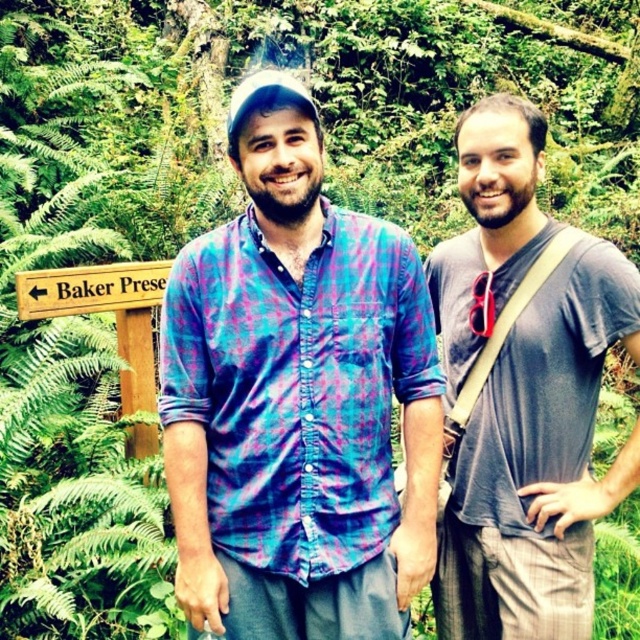
You are standing in a forest and see two points marked in the image. Which point is closer to you, point (540, 428) or point (74, 304)?

Point (540, 428) is closer to the viewer than point (74, 304).

Based on the scene description, where is the plaid fabric shirt at center located in terms of coordinates?

The plaid fabric shirt at center is located at coordinates point (x=296, y=397).